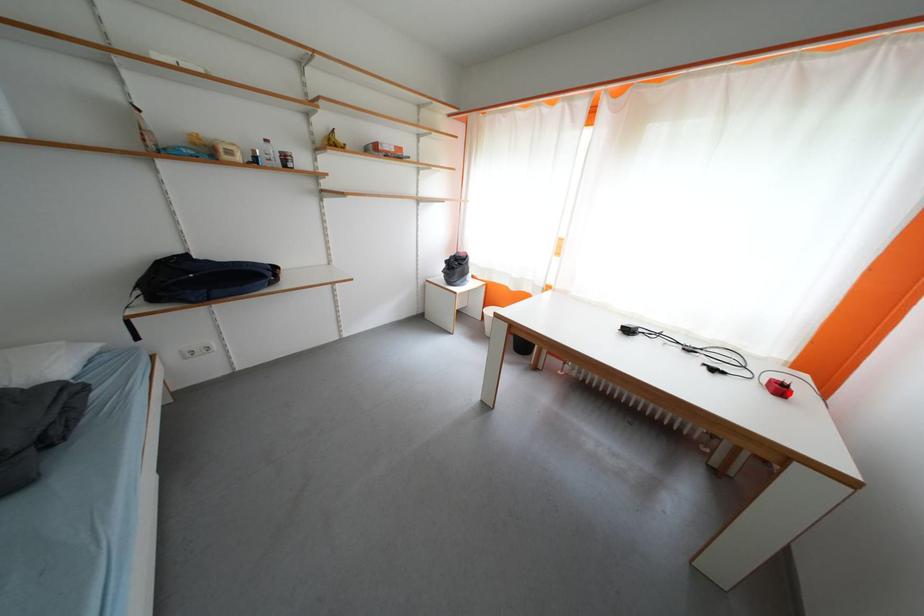
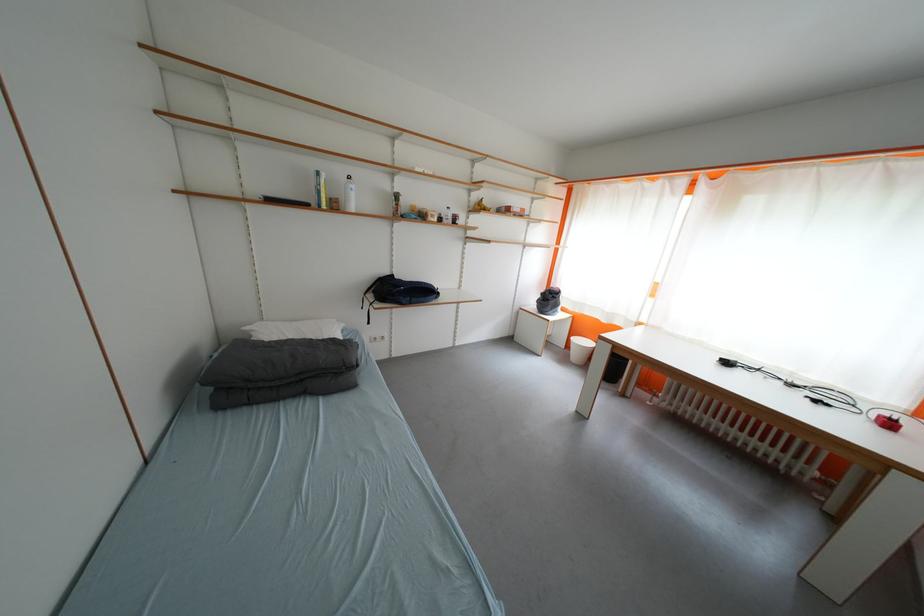
In the second image, find the point that corresponds to the highlighted location in the first image.

(897, 428)